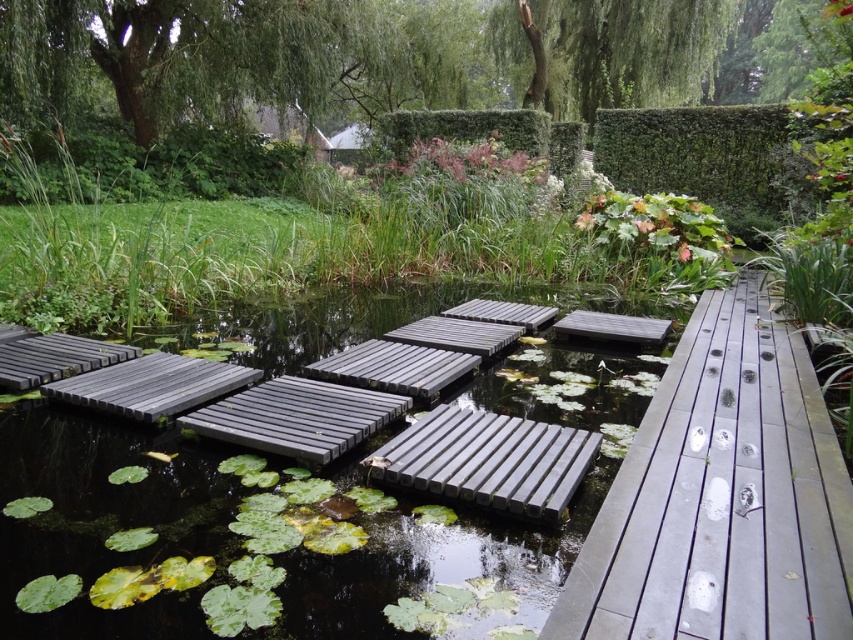
You are a gardener who needs to move a heavy tool from the charcoal gray wood floating bridge at lower left to the green leafy tree at upper left. Considering the tool weighs 20 kg and you can carry it for up to 10 meters, can you carry it directly without needing to rest?

The distance between the green leafy tree at upper left and the charcoal gray wood floating bridge at lower left is 8.25 meters. Since the gardener can carry the 20 kg tool for up to 10 meters, they can move it directly without needing to rest as the distance is within their carrying capacity.

You are standing in the garden and want to sit on the wooden park bench at center. Which object is closer to you as you approach the bench? Is it the smooth black planks at center or the bench itself?

The smooth black planks at center are closer to the viewer than the wooden park bench at center, so the smooth black planks at center would be closer as you approach the bench.